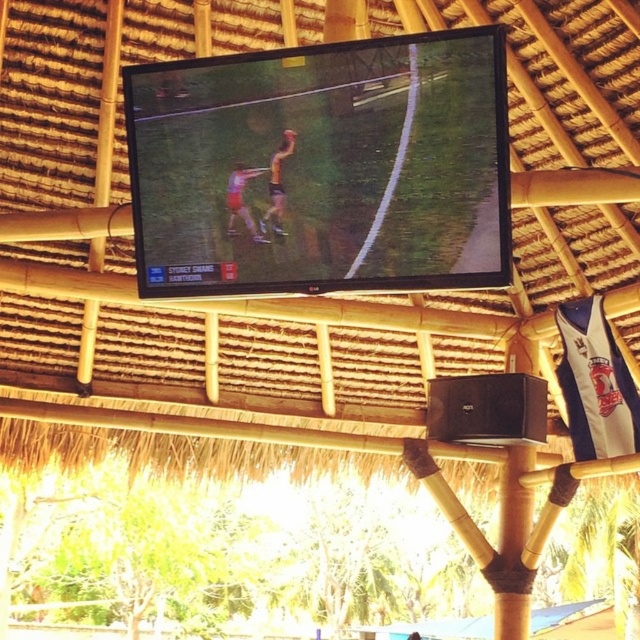
Question: Which object is positioned farthest from the yellow-orange jersey at center?

Choices:
 (A) matte pink shorts at center
 (B) flat-screen tv at center

Answer: (B)

Question: Among these objects, which one is nearest to the camera?

Choices:
 (A) flat-screen tv at center
 (B) matte pink shorts at center
 (C) yellow-orange jersey at center

Answer: (A)

Question: Which object appears closest to the camera in this image?

Choices:
 (A) yellow-orange jersey at center
 (B) flat-screen tv at center
 (C) matte pink shorts at center

Answer: (B)

Question: Is yellow-orange jersey at center above matte pink shorts at center?

Choices:
 (A) no
 (B) yes

Answer: (B)

Question: Is yellow-orange jersey at center closer to the viewer compared to matte pink shorts at center?

Choices:
 (A) yes
 (B) no

Answer: (A)

Question: In this image, where is flat-screen tv at center located relative to yellow-orange jersey at center?

Choices:
 (A) left
 (B) right

Answer: (B)